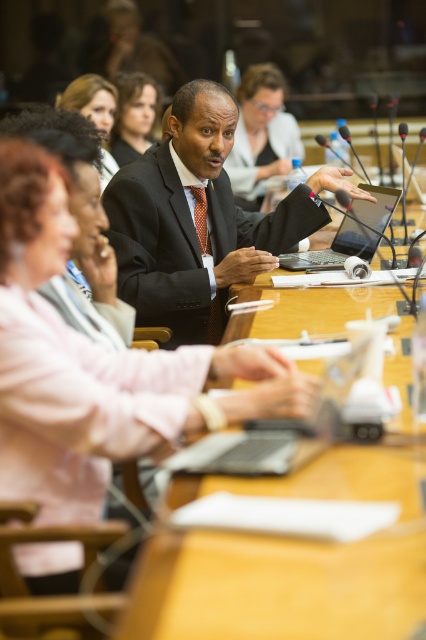
Question: Is silver metallic laptop at center further to camera compared to matte black hair at upper center?

Choices:
 (A) no
 (B) yes

Answer: (A)

Question: Which object is the closest to the sleek black laptop at center?

Choices:
 (A) matte black hair at upper center
 (B) silver metallic laptop at center
 (C) matte black hair at upper left

Answer: (C)

Question: From the image, what is the correct spatial relationship of dark gray suit at center in relation to orange textured tie at center?

Choices:
 (A) right
 (B) left

Answer: (A)

Question: Which object is farther from the camera taking this photo?

Choices:
 (A) dark gray suit at center
 (B) matte black hair at upper center
 (C) orange textured tie at center

Answer: (B)

Question: Does dark gray suit at center have a smaller size compared to sleek black laptop at center?

Choices:
 (A) yes
 (B) no

Answer: (B)

Question: Which object appears closest to the camera in this image?

Choices:
 (A) dark gray suit at center
 (B) red silk tie at center
 (C) orange textured tie at center

Answer: (A)